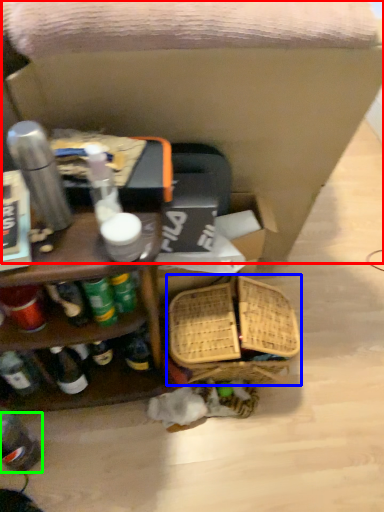
Question: Which object is the farthest from swivel chair (highlighted by a red box)? Choose among these: basket (highlighted by a blue box) or bottle (highlighted by a green box).

Choices:
 (A) basket
 (B) bottle

Answer: (B)